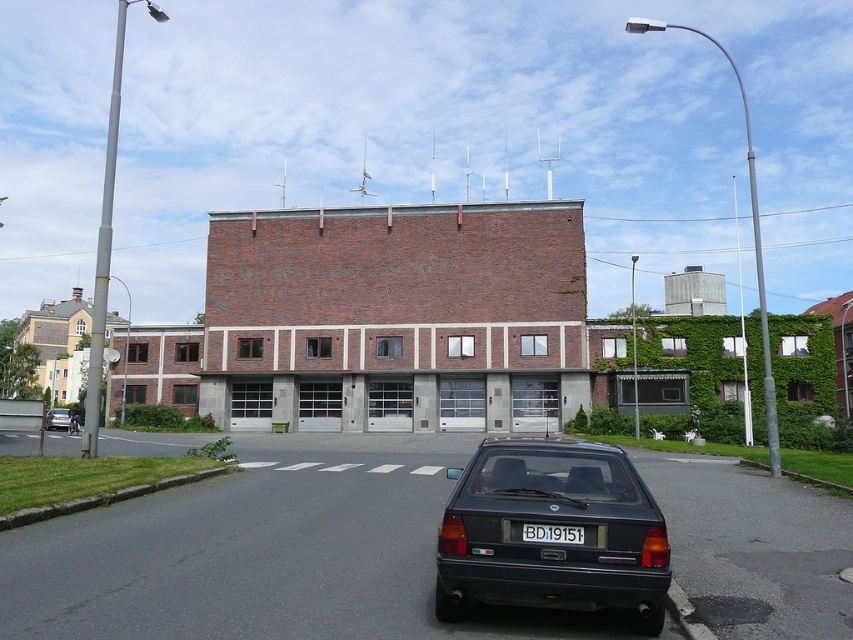
You are a delivery driver who needs to park your vehicle in the garage of the building. The garage has a height restriction of 1.8 meters. You have a matte black hatchback at center and a matte black car at lower center. Which vehicle should you choose to park without hitting the garage ceiling?

The matte black hatchback at center is shorter than the matte black car at lower center. Therefore, the matte black hatchback at center should be chosen to park in the garage as it is less likely to hit the ceiling due to its shorter height.

Looking at this image, you are standing in front of the building and looking at two points marked on its facade. The first point is at coordinates point (634,608) and the second is at point (555,541). Which point is closer to you?

Point (555,541) is closer to you because it is not as far as point (634,608), which is further away according to their positions.

You are a delivery driver who needs to park your matte black car at lower center in front of the building. There is a black plastic license plate at center attached to a signpost. Can you park your car so that the license plate is visible from the front of the car?

The black plastic license plate at center is to the right of the matte black car at lower center, so if you park the matte black car at lower center such that its front faces away from the license plate, the license plate will be visible from the front of the car.